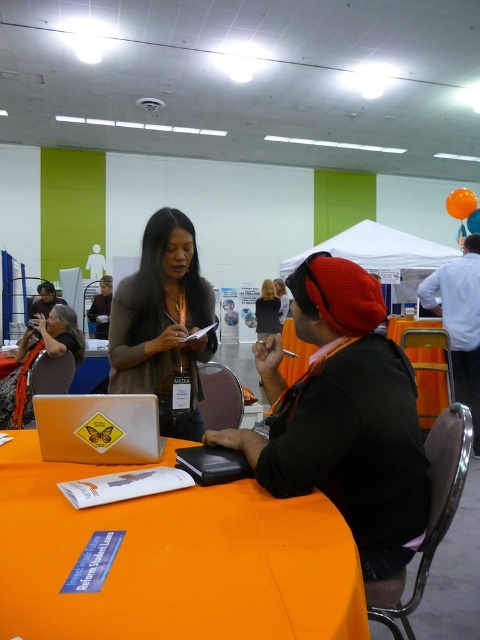
You are organizing a photo shoot and need to ensure that the matte black jacket at center and the yellow matte laptop at center are visible in the frame. Based on their positions, which object should be placed closer to the camera to ensure both are in focus?

The matte black jacket at center is positioned on the right side of yellow matte laptop at center. To ensure both are in focus, the yellow matte laptop at center should be placed closer to the camera since it is positioned to the left of the matte black jacket at center, allowing for better depth of field coverage.

You are organizing a small workshop and need to place a 12 inch wide whiteboard between the orange fabric table at center and the yellow matte laptop at center. Based on the available space, will the whiteboard fit between them?

The distance between the orange fabric table at center and the yellow matte laptop at center is 10.70 inches. Since the whiteboard is 12 inches wide, it will not fit in the space between them as the required space is larger than the available distance.

You are organizing an event and need to place a new item on the table. The table has limited space. Given the yellow matte laptop at center and the matte orange scarf at center, which object takes up more horizontal space on the table?

The matte orange scarf at center takes up more horizontal space on the table because its width is greater than the yellow matte laptop at center.